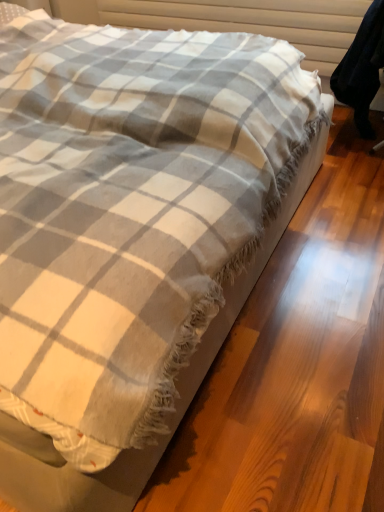
The image size is (384, 512). What do you see at coordinates (362, 69) in the screenshot?
I see `dark blue fabric swivel chair at right` at bounding box center [362, 69].

What is the approximate width of dark blue fabric swivel chair at right?

13.23 inches.

Measure the distance between dark blue fabric swivel chair at right and camera.

The depth of dark blue fabric swivel chair at right is 5.47 feet.

Where is `dark blue fabric swivel chair at right`? Image resolution: width=384 pixels, height=512 pixels. dark blue fabric swivel chair at right is located at coordinates (362, 69).

Where is `dark blue fabric swivel chair at right`? Image resolution: width=384 pixels, height=512 pixels. dark blue fabric swivel chair at right is located at coordinates (362, 69).